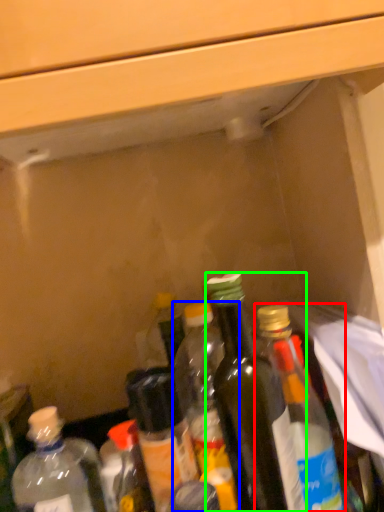
Question: Which object is positioned farthest from bottle (highlighted by a red box)? Select from bottle (highlighted by a blue box) and bottle (highlighted by a green box).

Choices:
 (A) bottle
 (B) bottle

Answer: (A)